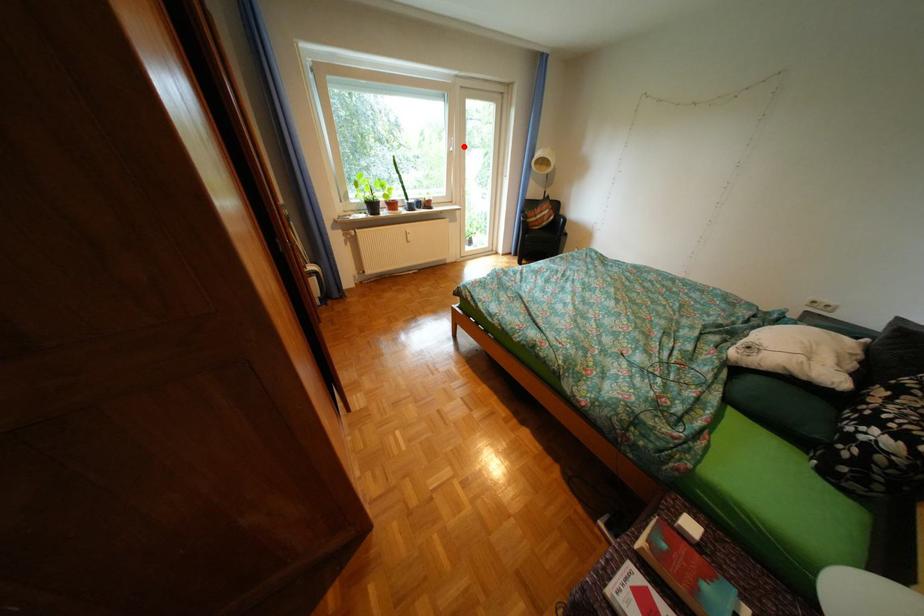
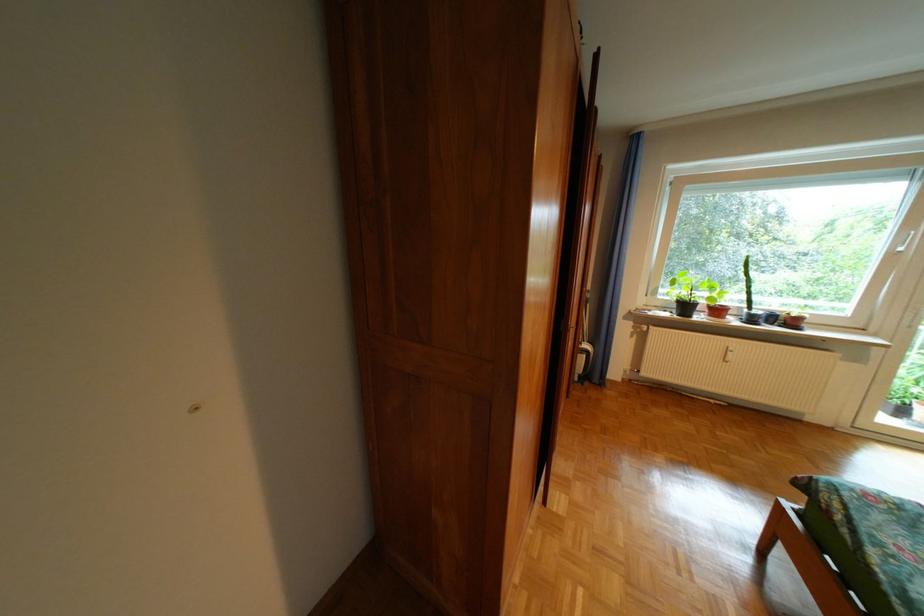
Question: I am providing you with two images of the same scene from different viewpoints. In image1, a red point is highlighted. Considering the same 3D point in image2, which of the following is correct?

Choices:
 (A) It is closer
 (B) It is farther

Answer: (B)